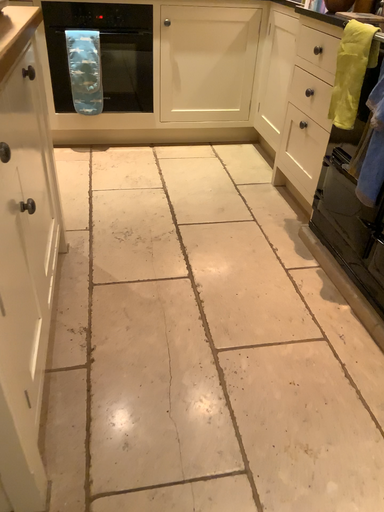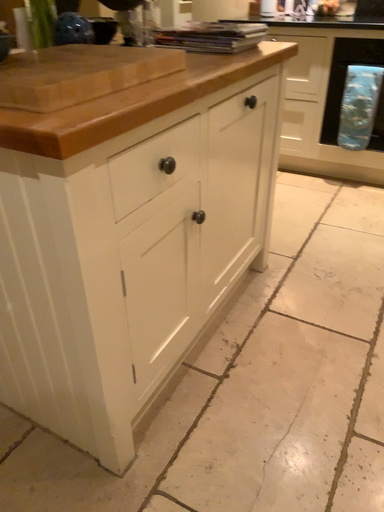
Question: How did the camera likely rotate when shooting the video?

Choices:
 (A) rotated downward
 (B) rotated upward

Answer: (B)